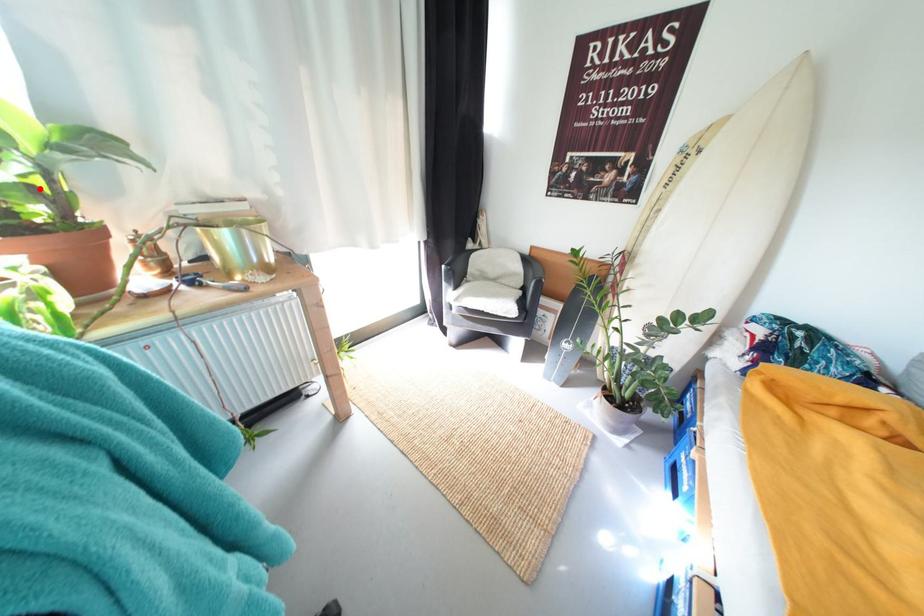
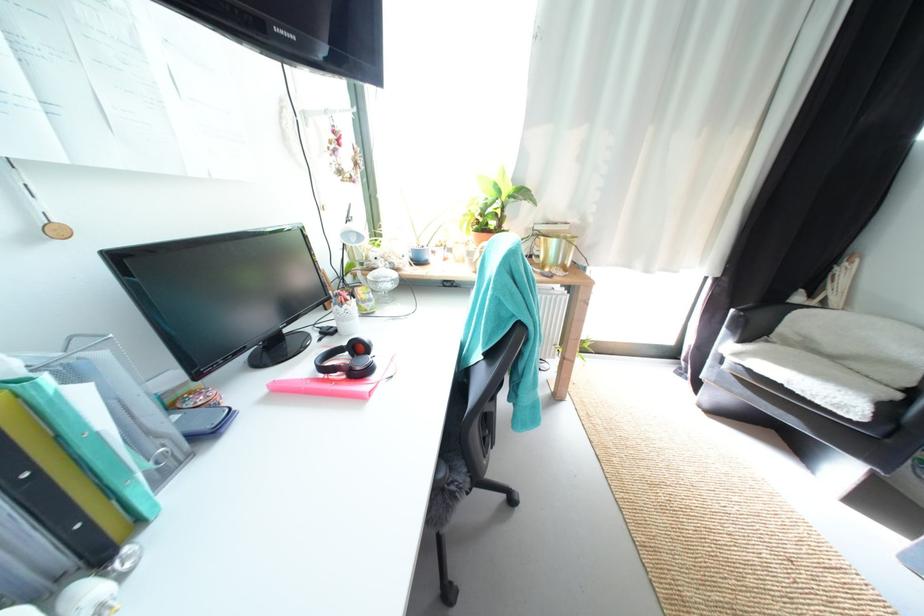
The point at the highlighted location is marked in the first image. Where is the corresponding point in the second image?

(505, 216)